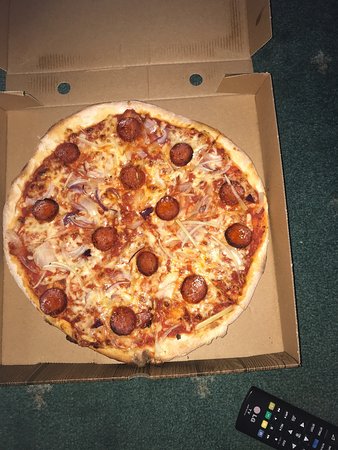
Where is `remote`? remote is located at coordinates (260, 420).